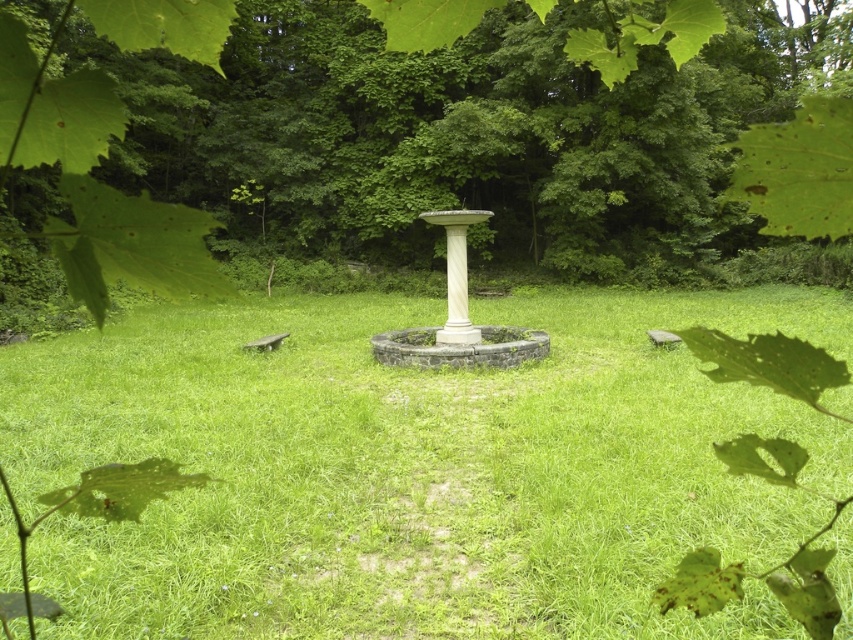
You are planning to place a new statue that requires a 3x3 meter space. Looking at the image, which area between the green grassy at center and green leafy tree at center would allow enough space for the statue?

The green leafy tree at center is larger than the green grassy at center, so the area around the green grassy at center would have more space available for placing the statue.

You are a gardener planning to plant a new flower bed between the green grassy at center and the green leafy tree at center. Based on their positions, where should the flower bed be placed?

The flower bed should be placed below the green leafy tree at center since the green grassy at center is already located below it.